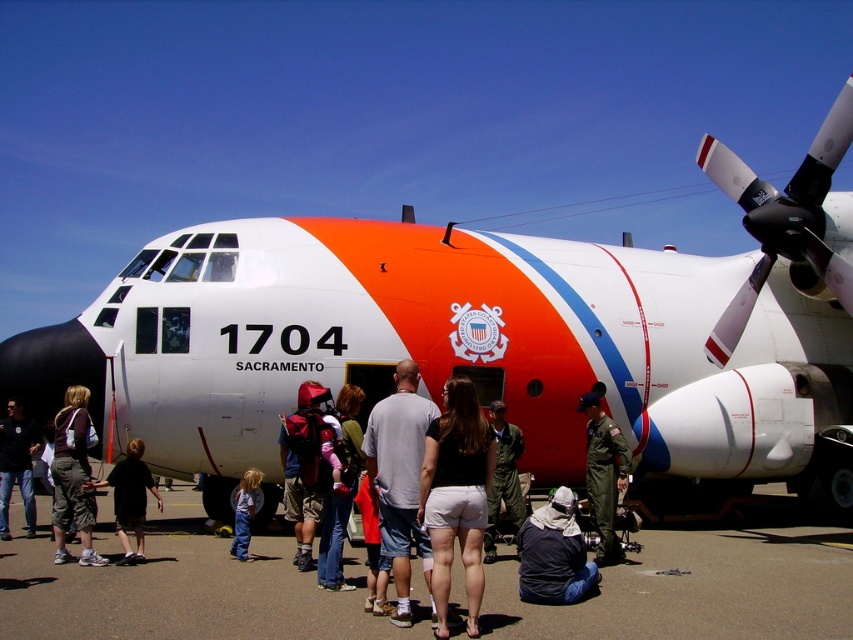
You are a photographer standing at the edge of the airfield. You want to take a photo of the gray cotton shirt at center and the red fabric backpack at center so that both are clearly visible in the frame. Considering the distance between them, what is the minimum focal length lens you should use if your camera has a sensor size of 24mm x 36mm?

The minimum focal length lens required would depend on the desired field of view to include both the gray cotton shirt at center and the red fabric backpack at center separated by 2.42 meters. However, without specific information about the camera sensor size and desired framing, an exact calculation cannot be provided. Please provide more details for an accurate answer.

You are a pilot standing on the light blue denim jeans at lower center and want to walk to the smooth asphalt tarmac at center. Which direction should you walk to reach it?

The smooth asphalt tarmac at center is in front of light blue denim jeans at lower center, so you should walk forward to reach it.